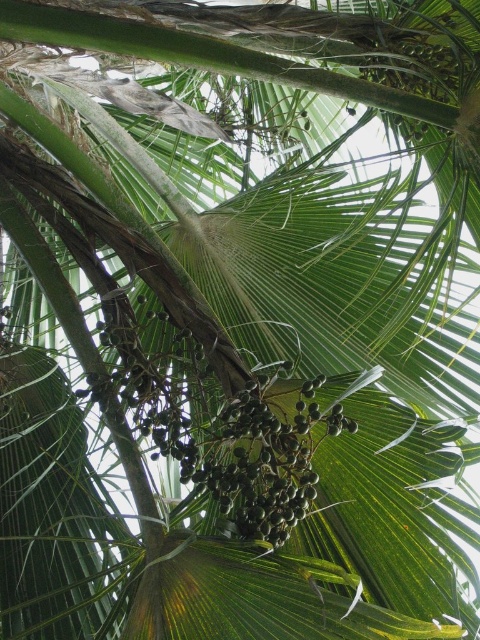
You are an artist sketching the palm tree and want to accurately depict the size relationship between the green matte fruit at center and the green matte palm fruit at upper center. Which fruit should you draw larger?

The green matte fruit at center should be drawn larger since it has a greater height compared to the green matte palm fruit at upper center.

You are standing in front of a palm tree and notice a point marked at coordinates (x=245, y=452). Based on the scene description, what object is located at this point?

The point at (x=245, y=452) marks the green matte fruit at center.

You are examining a palm tree image. There are two points marked on the image at coordinates point [83,394] and point [389,65]. Which of these points is nearer to the viewer?

Point [83,394] is closer to the camera than point [389,65].